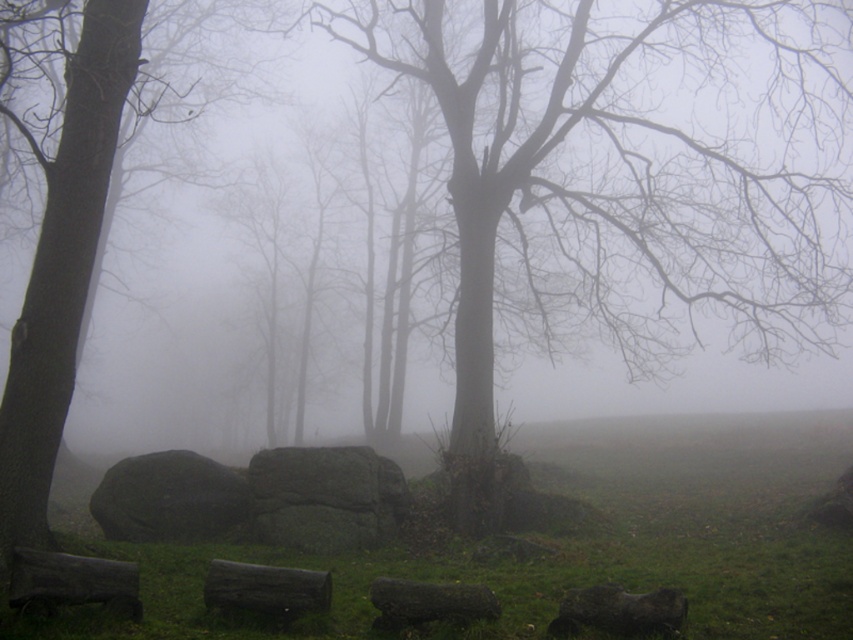
Question: Which of the following is the farthest from the observer?

Choices:
 (A) green mossy rock at center
 (B) dark brown wood at center
 (C) rough gray rock at lower center
 (D) dark brown wood at lower left

Answer: (C)

Question: Can you confirm if smooth bark tree at center is positioned to the left of rough gray rock at lower center?

Choices:
 (A) no
 (B) yes

Answer: (A)

Question: Which is farther from the smooth bark tree at center?

Choices:
 (A) dark brown wood at center
 (B) smooth gray tree trunk at left
 (C) rough gray rock at lower center
 (D) dark brown wood at lower left

Answer: (C)

Question: Can you confirm if smooth gray tree trunk at left is thinner than green mossy rock at center?

Choices:
 (A) no
 (B) yes

Answer: (A)

Question: Is smooth bark tree at center to the left of smooth gray tree trunk at left from the viewer's perspective?

Choices:
 (A) no
 (B) yes

Answer: (A)

Question: Among these objects, which one is farthest from the camera?

Choices:
 (A) smooth gray tree trunk at left
 (B) green mossy rock at center
 (C) rough gray rock at lower center

Answer: (C)